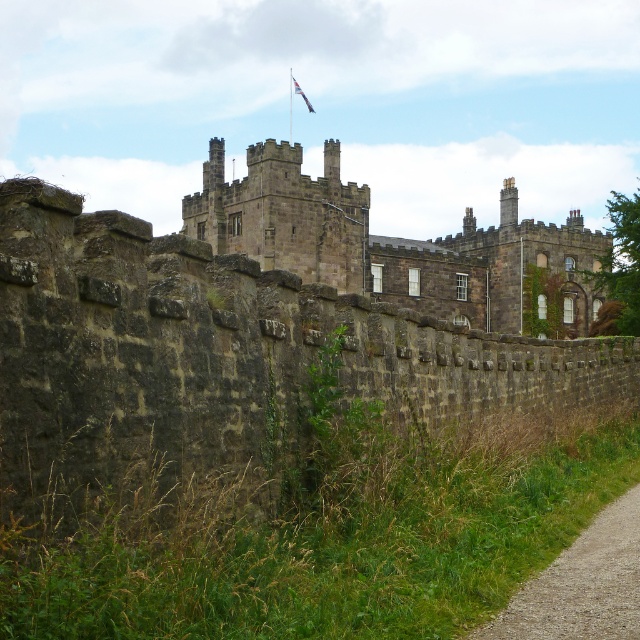
You are a visitor approaching the historic stone building and see the gravel path at lower right and the blue fabric flag at upper center. Which object takes up more area in the image?

The blue fabric flag at upper center takes up more area than the gravel path at lower right.

You are a tour guide leading a group to the gravel path at lower right from the dark stone castle at center. What is the approximate distance you need to walk?

The distance between the dark stone castle at center and the gravel path at lower right is 236.98 feet, so you need to walk approximately 237 feet.

You are a visitor approaching the historic stone building and see the gravel path at lower right and the blue fabric flag at upper center. Which object is closer to the ground?

The gravel path at lower right is closer to the ground since it has a lesser height compared to the blue fabric flag at upper center.